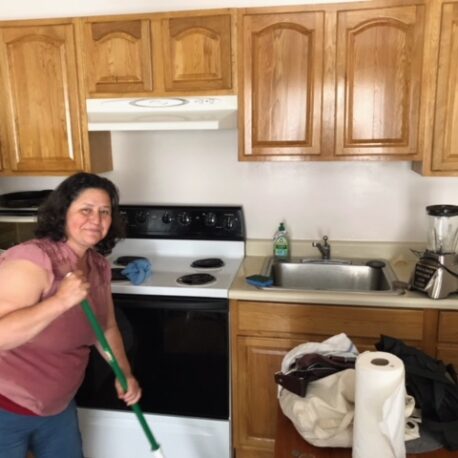
Where is `blender`? The image size is (458, 458). blender is located at coordinates click(x=447, y=263).